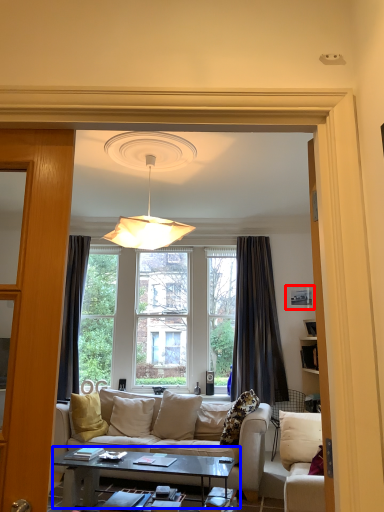
Question: Which point is further to the camera, picture frame (highlighted by a red box) or coffee table (highlighted by a blue box)?

Choices:
 (A) picture frame
 (B) coffee table

Answer: (A)